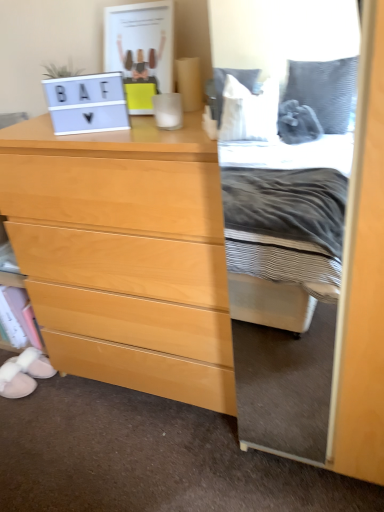
Locate an element on the screen. The height and width of the screenshot is (512, 384). free space in front of white fluffy slippers at lower left, acting as the 2th shoe starting from the front is located at coordinates (33, 403).